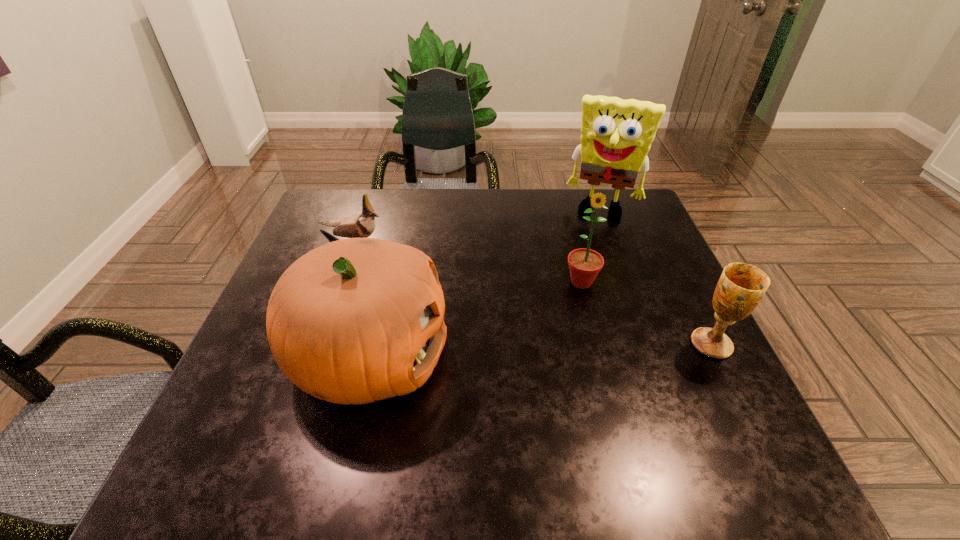
The width and height of the screenshot is (960, 540). In order to click on pumpkin in this screenshot , I will do `click(353, 321)`.

What are the coordinates of `chalice` in the screenshot? It's located at (741, 286).

Identify the location of the third farthest object. 584,264.

Find the location of a particular element. This screenshot has width=960, height=540. the farthest object is located at coordinates (616, 135).

At what (x,y) coordinates should I click in order to perform the action: click on the tallest object. Please return your answer as a coordinate pair (x, y). Looking at the image, I should click on (616, 135).

The width and height of the screenshot is (960, 540). I want to click on the second farthest object, so click(x=362, y=224).

Identify the location of vacant space situated 0.360m on the face of the pumpkin. Image resolution: width=960 pixels, height=540 pixels. (626, 356).

Where is `vacant space located 0.100m on the left of the chalice`? This screenshot has height=540, width=960. vacant space located 0.100m on the left of the chalice is located at coordinates (643, 345).

Identify the location of vacant position located on the face of the sunflower. (559, 421).

Image resolution: width=960 pixels, height=540 pixels. Find the location of `free space located on the face of the sunflower`. free space located on the face of the sunflower is located at coordinates (565, 380).